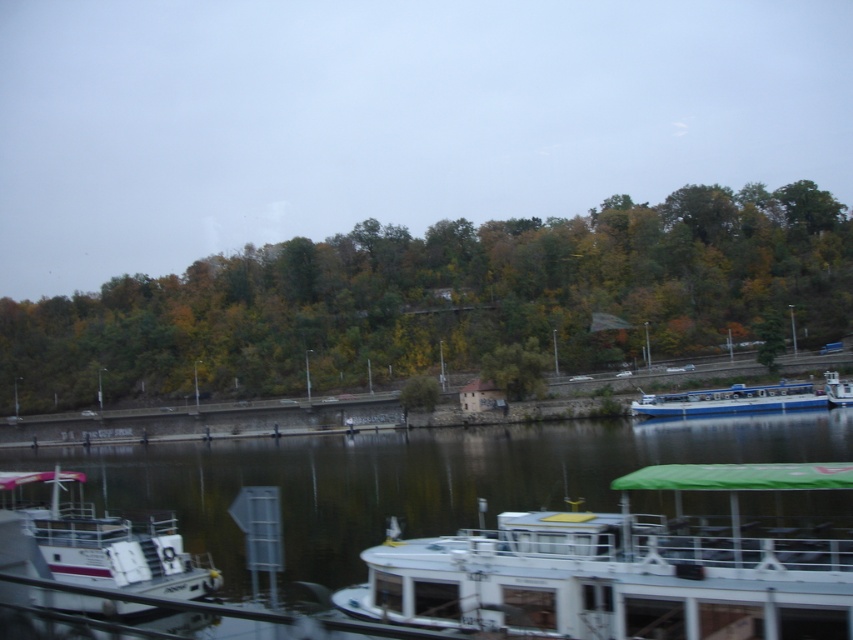
You are standing at the center of the image and want to locate the white plastic boat at lower left. According to the coordinates provided, in which direction should you look to find it?

The white plastic boat at lower left is located at coordinates point (97,545), which means it is positioned to the lower left of the image center. Therefore, you should look towards the lower left direction to find it.

You are standing on the riverside dock and want to take a photo of both the green leafy trees at center and the white glossy boat at lower center. Which object should you adjust your camera angle upwards to include in your photo?

You should adjust your camera angle upwards to include the green leafy trees at center because they are located above the white glossy boat at lower center.

You are standing on the riverside dock and see the dark green water at center and the blue polished wood boat at right. Which object is located lower in the image?

The dark green water at center is located below the blue polished wood boat at right, so it is lower in the image.